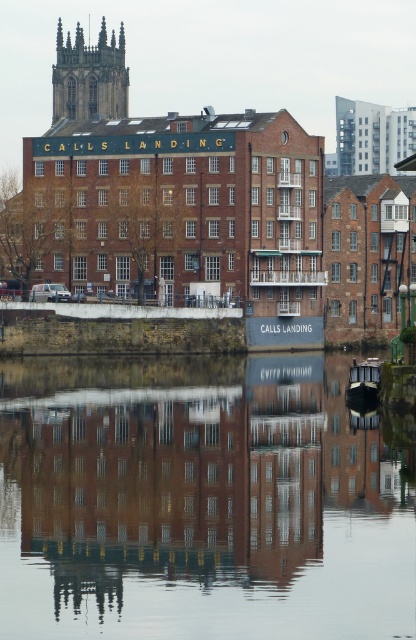
Question: Does smooth water at center lie in front of dark gray stone tower at upper left?

Choices:
 (A) yes
 (B) no

Answer: (A)

Question: Does smooth water at center have a greater width compared to dark gray stone tower at upper left?

Choices:
 (A) yes
 (B) no

Answer: (A)

Question: Among these objects, which one is nearest to the camera?

Choices:
 (A) smooth water at center
 (B) dark gray stone tower at upper left

Answer: (A)

Question: Does smooth water at center appear on the left side of dark gray stone tower at upper left?

Choices:
 (A) yes
 (B) no

Answer: (B)